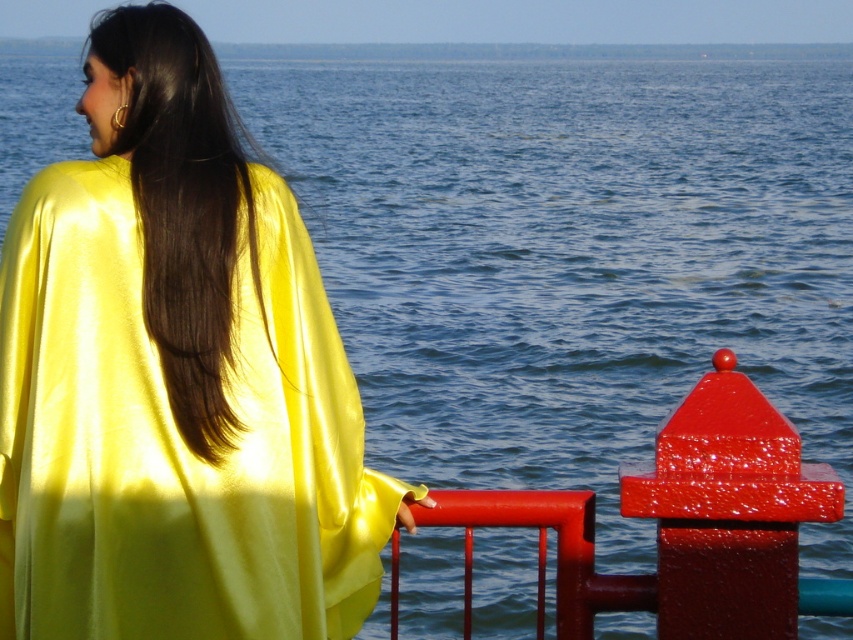
Question: Can you confirm if shiny yellow cape at upper left is positioned to the right of satin smooth hair at upper left?

Choices:
 (A) yes
 (B) no

Answer: (B)

Question: Among these points, which one is nearest to the camera?

Choices:
 (A) click(225, 276)
 (B) click(57, 531)

Answer: (B)

Question: Which object is closer to the camera taking this photo?

Choices:
 (A) satin smooth hair at upper left
 (B) shiny yellow cape at upper left

Answer: (B)

Question: Is shiny yellow cape at upper left thinner than satin smooth hair at upper left?

Choices:
 (A) no
 (B) yes

Answer: (A)

Question: Does shiny yellow cape at upper left appear under satin smooth hair at upper left?

Choices:
 (A) no
 (B) yes

Answer: (B)

Question: Which of the following is the closest to the observer?

Choices:
 (A) shiny yellow cape at upper left
 (B) satin smooth hair at upper left

Answer: (A)